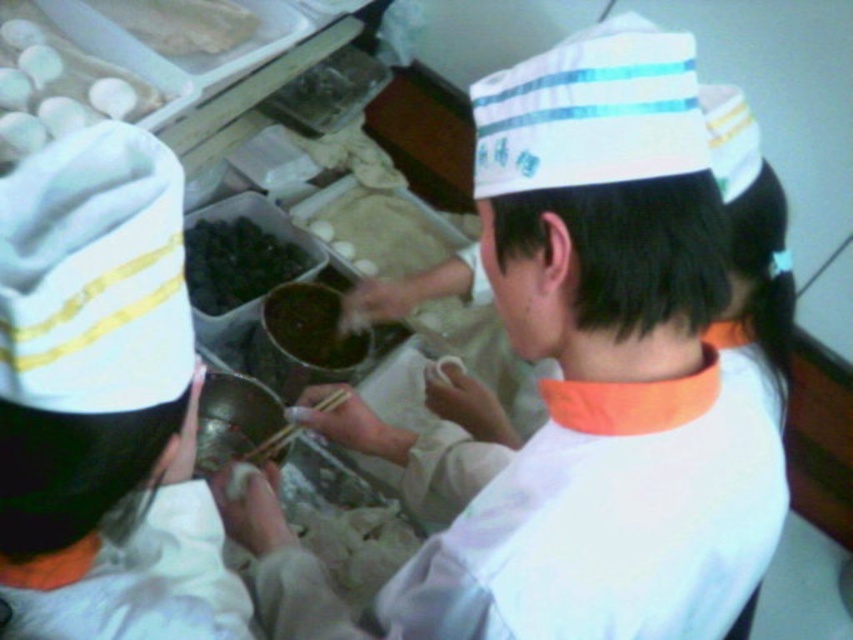
Is dark matte paste at center positioned before brown matte bowl at center?

Yes.

Which is in front, point (334, 289) or point (352, 250)?

Point (334, 289) is in front.

This screenshot has height=640, width=853. I want to click on dark matte paste at center, so click(311, 324).

What do you see at coordinates (579, 380) in the screenshot?
I see `white fabric shirt at center` at bounding box center [579, 380].

In the scene shown: Is the position of white fabric shirt at center less distant than that of dark matte paste at center?

Yes.

You are a GUI agent. You are given a task and a screenshot of the screen. Output one action in this format:
    pyautogui.click(x=<x>, y=<y>)
    Task: Click on the white fabric shirt at center
    
    Given the screenshot: What is the action you would take?
    pyautogui.click(x=579, y=380)

The width and height of the screenshot is (853, 640). Identify the location of white fabric shirt at center. (579, 380).

Does white matte eggs at upper left have a greater height compared to white matte rice at upper left?

Yes.

Does white matte eggs at upper left have a lesser width compared to white matte rice at upper left?

In fact, white matte eggs at upper left might be wider than white matte rice at upper left.

Is point (55, 92) farther from viewer compared to point (180, 44)?

No, it is not.

Where is `white matte eggs at upper left`? white matte eggs at upper left is located at coordinates (57, 90).